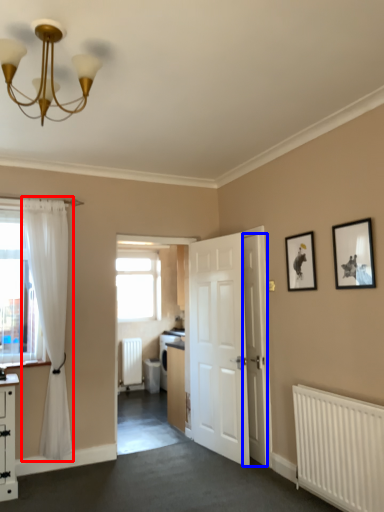
Question: Which of the following is the farthest to the observer, curtain (highlighted by a red box) or door (highlighted by a blue box)?

Choices:
 (A) curtain
 (B) door

Answer: (B)